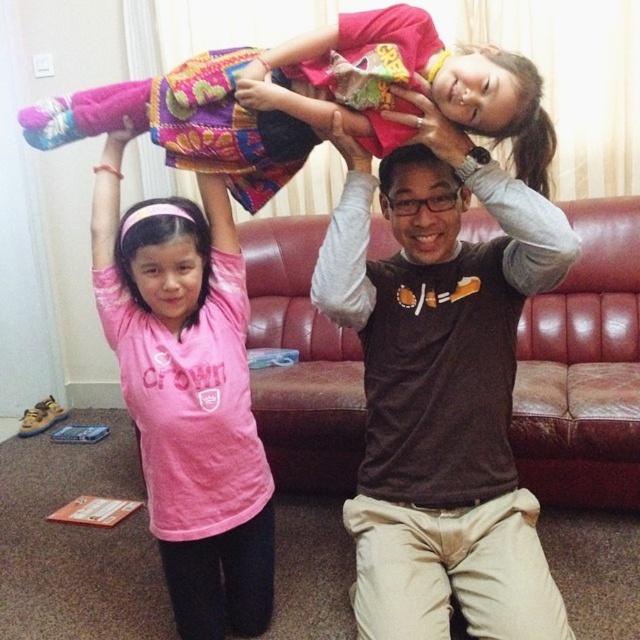
Question: Which object is the closest to the multicolored fabric at upper center?

Choices:
 (A) brown matte head at center
 (B) brown matte shirt at center
 (C) pink matte shirt at center

Answer: (A)

Question: Observing the image, what is the correct spatial positioning of brown matte shirt at center in reference to pink matte shirt at center?

Choices:
 (A) below
 (B) above

Answer: (B)

Question: Which object is farther from the camera taking this photo?

Choices:
 (A) brown matte shirt at center
 (B) multicolored fabric at upper center
 (C) pink matte shirt at center

Answer: (C)

Question: Can you confirm if pink matte shirt at center is positioned below brown matte head at center?

Choices:
 (A) yes
 (B) no

Answer: (A)

Question: Is multicolored fabric at upper center positioned behind brown matte head at center?

Choices:
 (A) yes
 (B) no

Answer: (B)

Question: Among these objects, which one is farthest from the camera?

Choices:
 (A) multicolored fabric at upper center
 (B) pink matte shirt at center
 (C) brown matte shirt at center

Answer: (B)